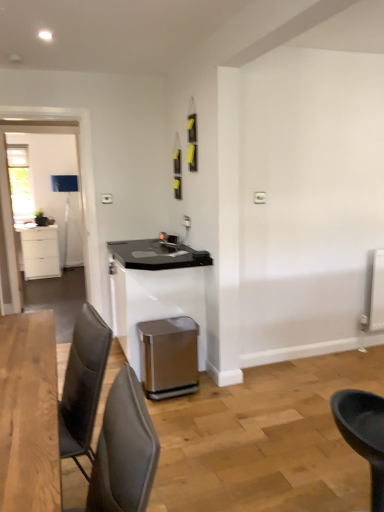
Question: In the image, is satin white table at center on the left side or the right side of satin metallic trash can at lower center?

Choices:
 (A) left
 (B) right

Answer: (A)

Question: From the image's perspective, is satin white table at center above or below satin metallic trash can at lower center?

Choices:
 (A) above
 (B) below

Answer: (A)

Question: Estimate the real-world distances between objects in this image. Which object is farther from the satin metallic trash can at lower center?

Choices:
 (A) black plastic chair at lower right, placed as the first chair when sorted from right to left
 (B) satin white table at center
 (C) clear glass door at left
 (D) gray fabric chair at lower left, the 2th chair in the right-to-left sequence
 (E) white matte cabinet at left

Answer: (C)

Question: Which object is positioned closest to the black plastic chair at lower right, the 2th chair when ordered from left to right?

Choices:
 (A) gray fabric chair at lower left, the 1th chair in the front-to-back sequence
 (B) satin white table at center
 (C) satin metallic trash can at lower center
 (D) clear glass door at left
 (E) white matte cabinet at left

Answer: (A)